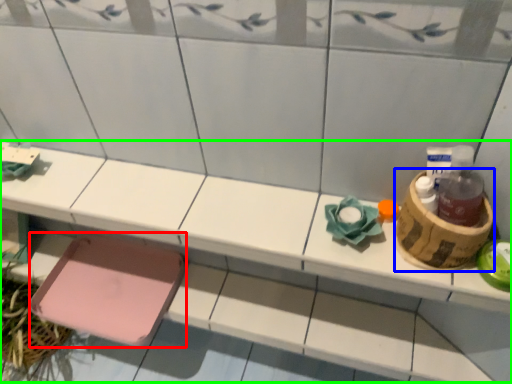
Question: Based on their relative distances, which object is farther from step stool (highlighted by a red box)? Choose from basket (highlighted by a blue box) and vanity (highlighted by a green box).

Choices:
 (A) basket
 (B) vanity

Answer: (A)